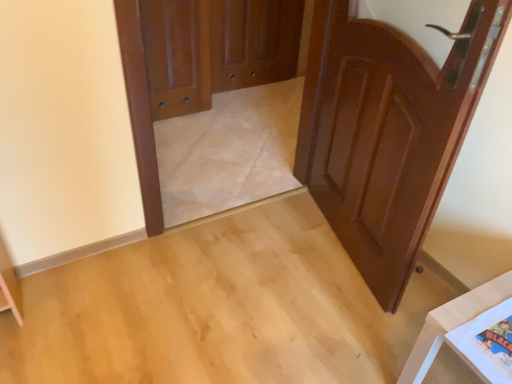
Where is `vacant region under shiny brown door at right, the 2th door in the back-to-front sequence (from a real-world perspective)`? Image resolution: width=512 pixels, height=384 pixels. vacant region under shiny brown door at right, the 2th door in the back-to-front sequence (from a real-world perspective) is located at coordinates (343, 252).